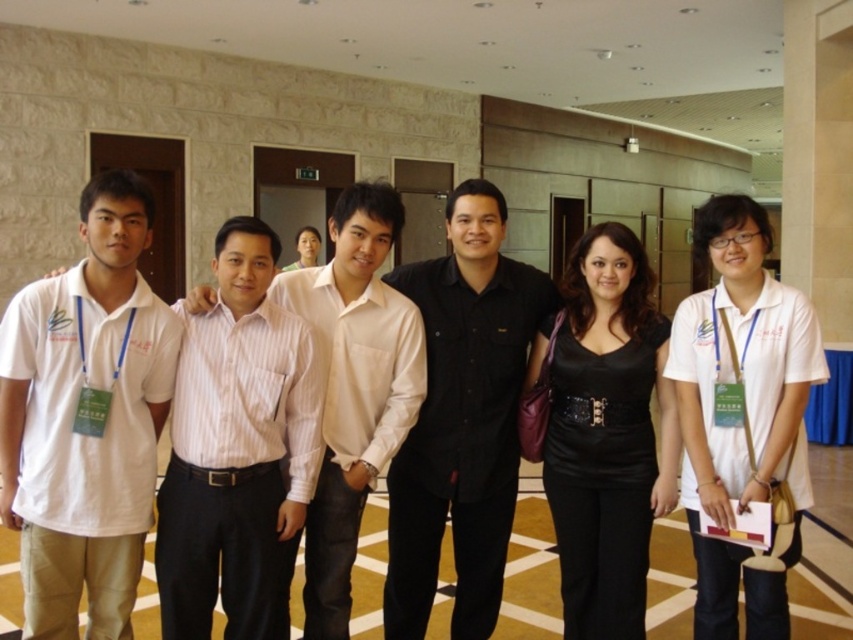
You are standing in front of the group photo and want to point out two specific points. The first point is at coordinate (482, 602) and the second is at (689, 332). Which of these two points is closer to you?

Point (482, 602) is closer to you because it is further to the viewer than point (689, 332).

You are a photographer adjusting camera settings. You need to ensure both the white cotton shirt at left and the black leather dress at center are in focus. Which object should you focus on first to ensure proper depth of field?

The white cotton shirt at left is shorter than the black leather dress at center. To ensure proper depth of field, focus on the black leather dress at center first since it is taller and farther away, allowing the shorter object to remain in focus as well.

You are standing in front of the group photo. There are two people you need to identify based on their clothing. The first is wearing a white cotton shirt at left, and the second is wearing a black leather dress at center. Which of these two is positioned closer to you?

The white cotton shirt at left is closer to the viewer than the black leather dress at center.